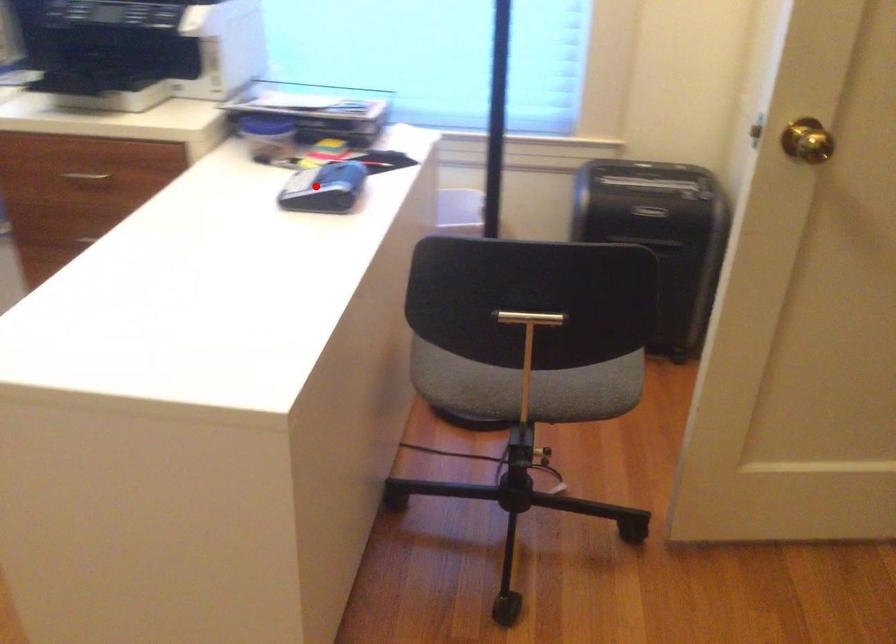
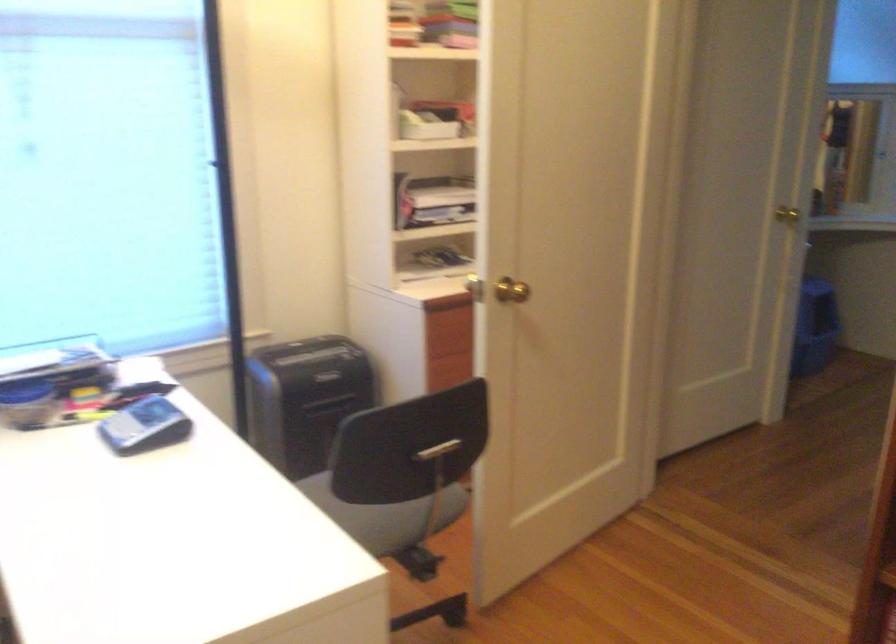
Locate, in the second image, the point that corresponds to the highlighted location in the first image.

(143, 426)